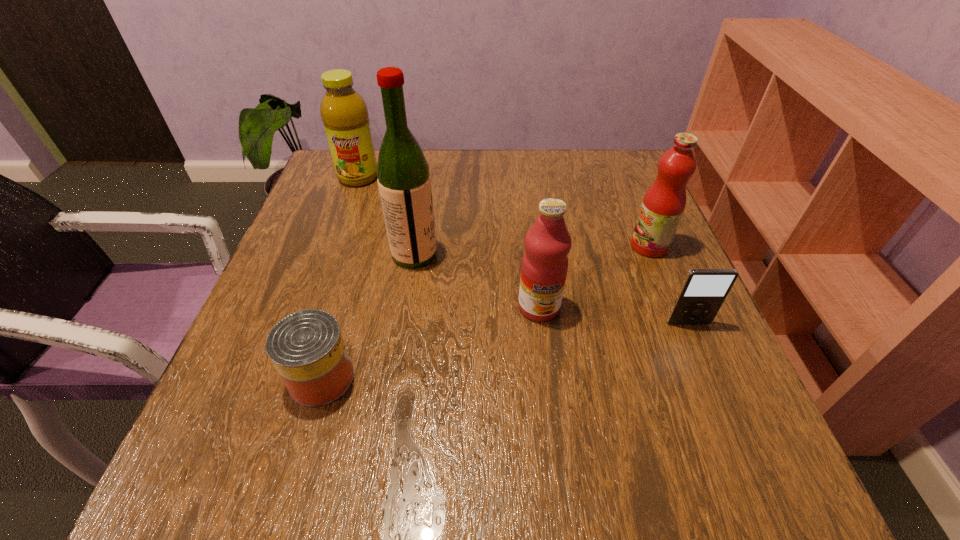
At what (x,y) coordinates should I click in order to perform the action: click on free space located on the label of the liquor. Please return your answer as a coordinate pair (x, y). The image size is (960, 540). Looking at the image, I should click on (599, 254).

At what (x,y) coordinates should I click in order to perform the action: click on vacant space located on the front label of the farthest fruit juice. Please return your answer as a coordinate pair (x, y). The height and width of the screenshot is (540, 960). Looking at the image, I should click on click(x=350, y=201).

Where is `free region located 0.150m on the front label of the second nearest fruit juice`? The height and width of the screenshot is (540, 960). free region located 0.150m on the front label of the second nearest fruit juice is located at coordinates (561, 246).

Where is `free space located on the front label of the second nearest fruit juice`? The width and height of the screenshot is (960, 540). free space located on the front label of the second nearest fruit juice is located at coordinates (528, 246).

Locate an element on the screen. blank space located 0.110m on the front label of the second nearest fruit juice is located at coordinates (579, 246).

Locate an element on the screen. The image size is (960, 540). free location located 0.080m on the label of the third object from right to left is located at coordinates (545, 361).

This screenshot has width=960, height=540. I want to click on vacant space located on the front-facing side of the iPod, so click(x=709, y=374).

The image size is (960, 540). Identify the location of vacant region located 0.120m on the right of the shortest object. (428, 378).

At what (x,y) coordinates should I click in order to perform the action: click on object at the far edge. Please return your answer as a coordinate pair (x, y). The width and height of the screenshot is (960, 540). Looking at the image, I should click on (344, 113).

The width and height of the screenshot is (960, 540). Identify the location of fruit juice located at the left edge. (344, 113).